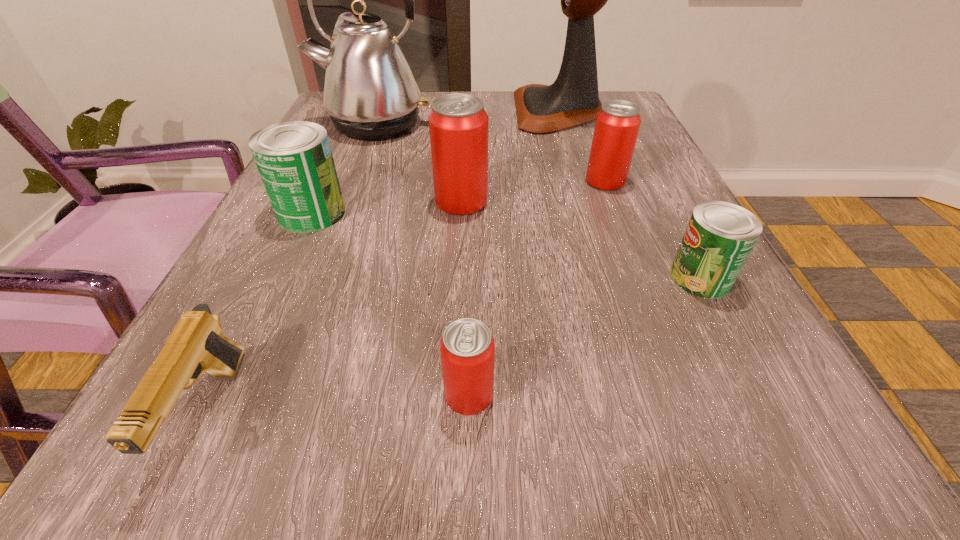
The image size is (960, 540). What are the coordinates of `free space between the pistol and the second tallest object` in the screenshot? It's located at 292,268.

Locate an element on the screen. The image size is (960, 540). free space between the second tallest object and the smallest red can is located at coordinates (421, 259).

This screenshot has width=960, height=540. Find the location of `free point between the kettle and the leftmost can`. free point between the kettle and the leftmost can is located at coordinates (343, 168).

Identify the location of vacant area that lies between the bigger green can and the third tallest object. tap(387, 207).

The image size is (960, 540). Find the location of `free spot between the fourth can from left to right and the kettle`. free spot between the fourth can from left to right and the kettle is located at coordinates (490, 152).

Find the location of `unoccupied area between the kettle and the sixth shortest object`. unoccupied area between the kettle and the sixth shortest object is located at coordinates (418, 163).

Where is `object that ranks as the second closest to the third tallest object`? Image resolution: width=960 pixels, height=540 pixels. object that ranks as the second closest to the third tallest object is located at coordinates (370, 92).

Choose which object is the second nearest neighbor to the second biggest red can. Please provide its 2D coordinates. Your answer should be formatted as a tuple, i.e. [(x, y)], where the tuple contains the x and y coordinates of a point satisfying the conditions above.

[(719, 237)]

Where is `the closest can to the smallest red can`? Image resolution: width=960 pixels, height=540 pixels. the closest can to the smallest red can is located at coordinates (719, 237).

Locate which can is the closest to the kettle. Please provide its 2D coordinates. Your answer should be formatted as a tuple, i.e. [(x, y)], where the tuple contains the x and y coordinates of a point satisfying the conditions above.

[(458, 124)]